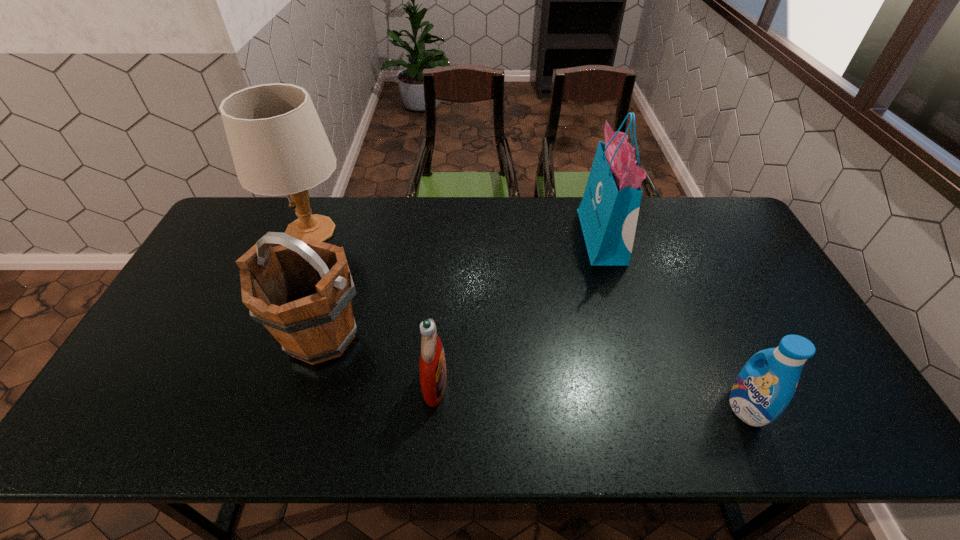
The width and height of the screenshot is (960, 540). Identify the location of table lamp. (279, 147).

Where is `shopping bag`? The width and height of the screenshot is (960, 540). shopping bag is located at coordinates (608, 213).

Locate an element on the screen. The width and height of the screenshot is (960, 540). bucket is located at coordinates (301, 290).

Locate an element on the screen. the right detergent is located at coordinates tap(760, 393).

Find the location of `the third object from right to left`. the third object from right to left is located at coordinates [x=432, y=366].

Find the location of a particular element. The image size is (960, 540). vacant space situated on the front of the table lamp is located at coordinates (288, 286).

The height and width of the screenshot is (540, 960). What are the coordinates of `vacant space situated 0.200m on the left of the shopping bag` in the screenshot? It's located at (524, 237).

Where is `free spot located on the left of the bucket`? Image resolution: width=960 pixels, height=540 pixels. free spot located on the left of the bucket is located at coordinates (186, 336).

Locate an element on the screen. blank area located on the front-facing side of the rightmost object is located at coordinates (622, 408).

This screenshot has width=960, height=540. In order to click on blank area located 0.140m on the front-facing side of the rightmost object in this screenshot , I will do `click(673, 408)`.